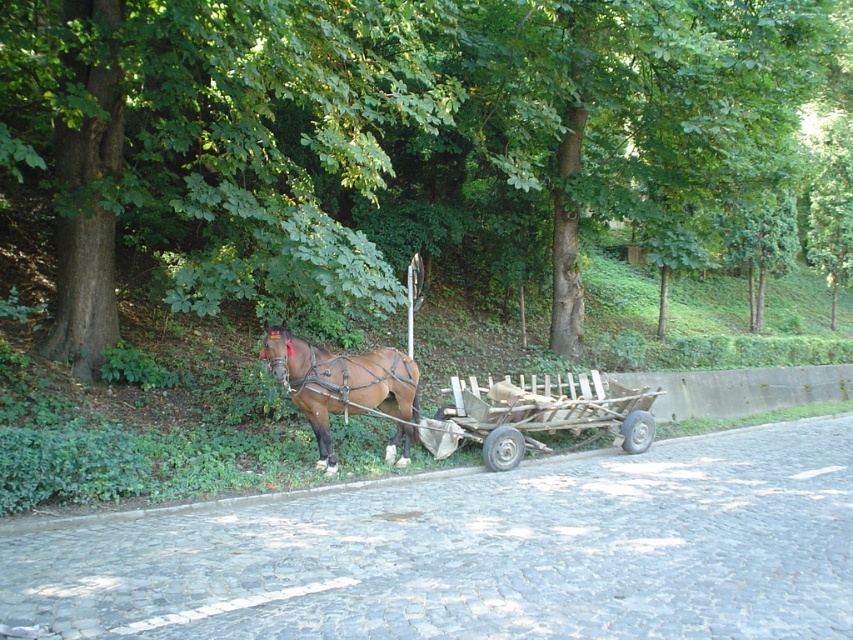
Question: Is brown wood tree at upper left to the left of wooden planks cart at lower right from the viewer's perspective?

Choices:
 (A) yes
 (B) no

Answer: (B)

Question: Which object appears closest to the camera in this image?

Choices:
 (A) brown glossy horse at center
 (B) wooden planks cart at lower right

Answer: (A)

Question: Does brown wood tree at upper left come behind brown glossy horse at center?

Choices:
 (A) yes
 (B) no

Answer: (B)

Question: Observing the image, what is the correct spatial positioning of brown wood tree at upper left in reference to wooden planks cart at lower right?

Choices:
 (A) above
 (B) below

Answer: (A)

Question: Which is farther from the brown glossy horse at center?

Choices:
 (A) wooden planks cart at lower right
 (B) brown wood tree at upper left

Answer: (B)

Question: Which object appears farthest from the camera in this image?

Choices:
 (A) wooden planks cart at lower right
 (B) brown glossy horse at center
 (C) brown wood tree at upper left

Answer: (A)